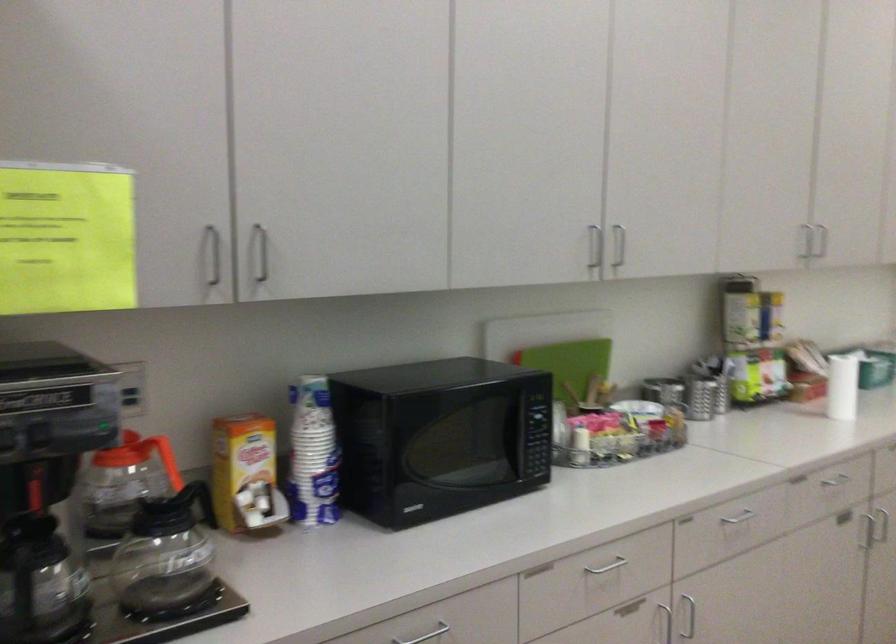
Describe the element at coordinates (203, 502) in the screenshot. I see `the black coffee pot handle` at that location.